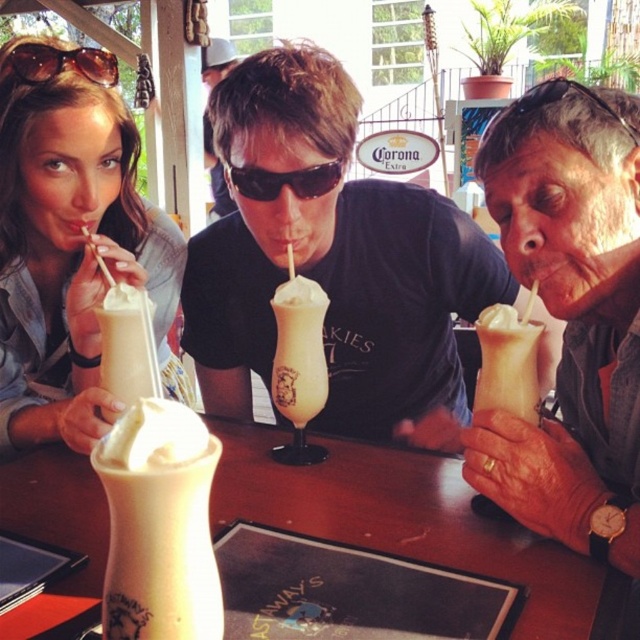
Question: Observing the image, what is the correct spatial positioning of peachy smoothie glass at center in reference to black plastic sunglasses at center?

Choices:
 (A) above
 (B) below

Answer: (B)

Question: Can you confirm if peachy smoothie glass at center is positioned above black plastic goggles at upper right?

Choices:
 (A) yes
 (B) no

Answer: (B)

Question: Which is nearer to the whipped cream topped glass at right?

Choices:
 (A) brown matte sunglasses at upper left
 (B) whipped cream topping at center

Answer: (B)

Question: Which object is farther from the camera taking this photo?

Choices:
 (A) white frosted glass at center
 (B) peachy smoothie glass at center

Answer: (B)

Question: Estimate the real-world distances between objects in this image. Which object is closer to the matte plastic cup at center?

Choices:
 (A) black plastic goggles at upper right
 (B) white frosted glass at center
 (C) matte cream milkshake at left

Answer: (A)

Question: Does whipped cream topped glass at center appear on the left side of black plastic sunglasses at center?

Choices:
 (A) yes
 (B) no

Answer: (A)